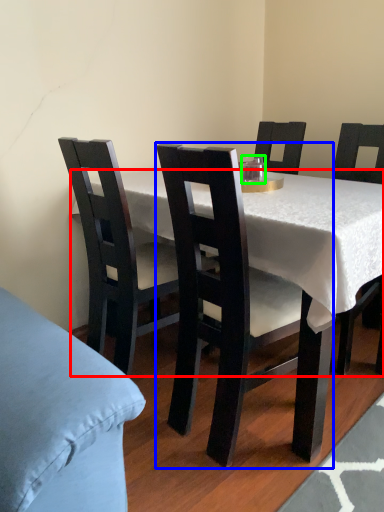
Question: Considering the real-world distances, which object is farthest from desk (highlighted by a red box)? chair (highlighted by a blue box) or coffee cup (highlighted by a green box)?

Choices:
 (A) chair
 (B) coffee cup

Answer: (B)